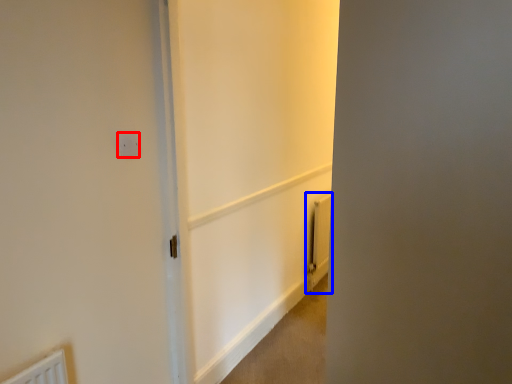
Question: Among these objects, which one is farthest to the camera, electric outlet (highlighted by a red box) or radiator (highlighted by a blue box)?

Choices:
 (A) electric outlet
 (B) radiator

Answer: (B)